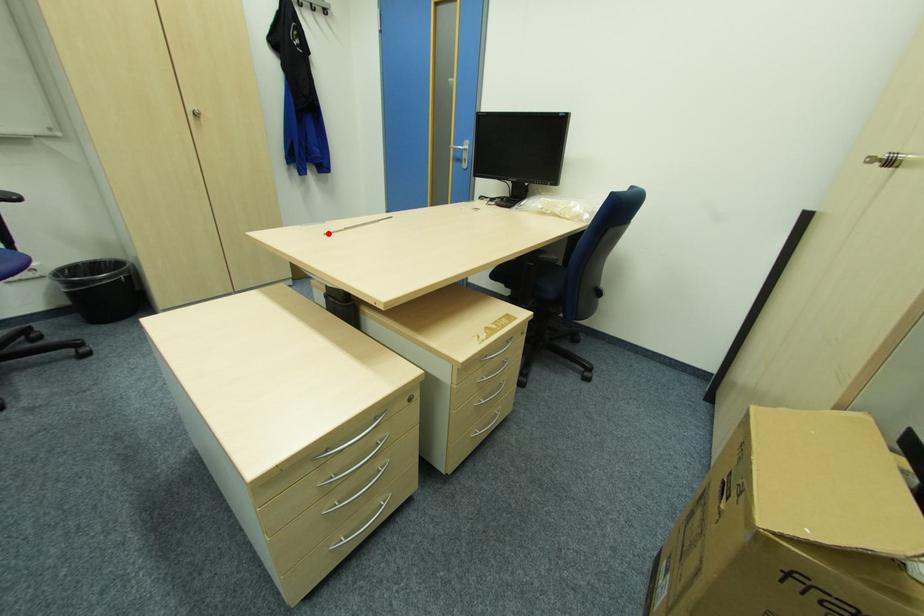
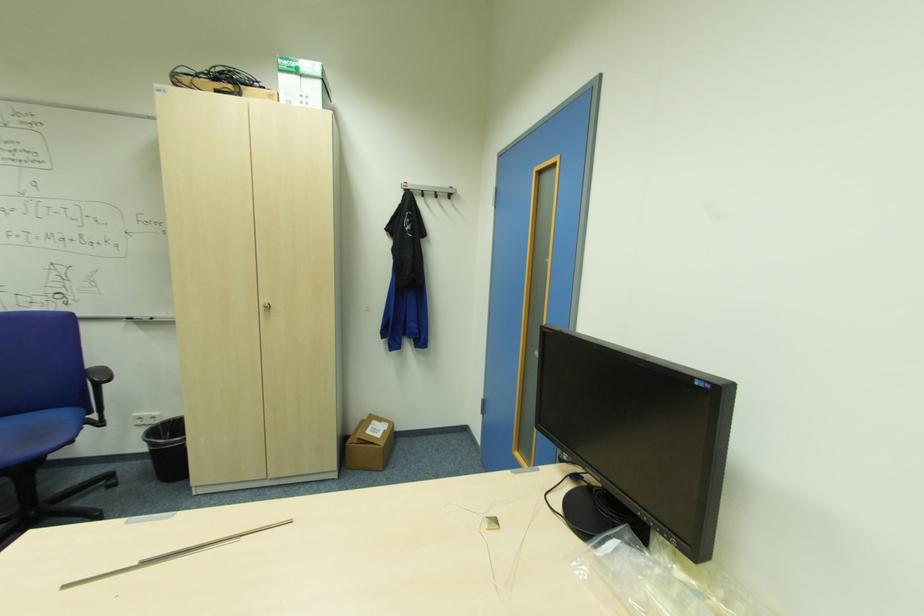
Find the pixel in the second image that matches the highlighted location in the first image.

(63, 589)